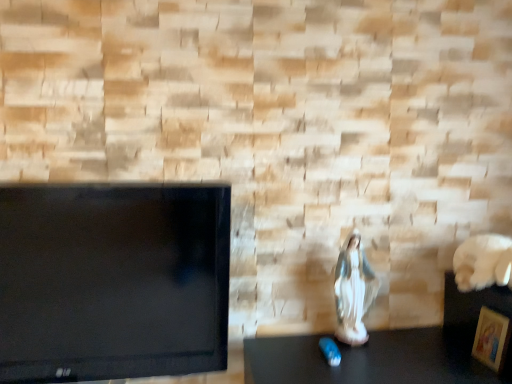
Question: Considering the positions of porcelain statue at center and wooden picture frame at lower right in the image, is porcelain statue at center wider or thinner than wooden picture frame at lower right?

Choices:
 (A) wide
 (B) thin

Answer: (A)

Question: In terms of height, does porcelain statue at center look taller or shorter compared to wooden picture frame at lower right?

Choices:
 (A) tall
 (B) short

Answer: (A)

Question: Is porcelain statue at center to the left or to the right of wooden picture frame at lower right in the image?

Choices:
 (A) left
 (B) right

Answer: (A)

Question: From the image's perspective, is wooden picture frame at lower right located above or below porcelain statue at center?

Choices:
 (A) above
 (B) below

Answer: (B)

Question: From a real-world perspective, is wooden picture frame at lower right above or below porcelain statue at center?

Choices:
 (A) below
 (B) above

Answer: (A)

Question: From their relative heights in the image, would you say wooden picture frame at lower right is taller or shorter than porcelain statue at center?

Choices:
 (A) short
 (B) tall

Answer: (A)

Question: Visually, is wooden picture frame at lower right positioned to the left or to the right of porcelain statue at center?

Choices:
 (A) left
 (B) right

Answer: (B)